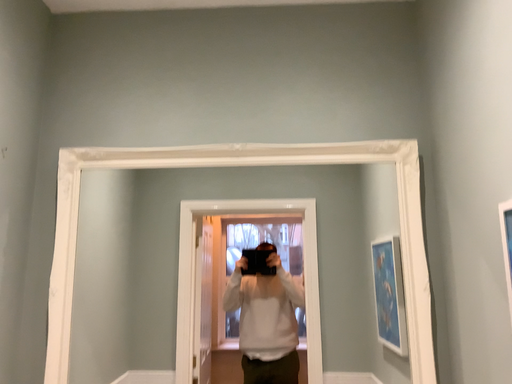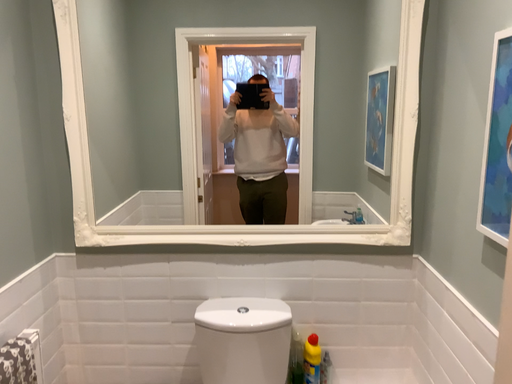
Question: How did the camera likely rotate when shooting the video?

Choices:
 (A) rotated downward
 (B) rotated upward

Answer: (A)